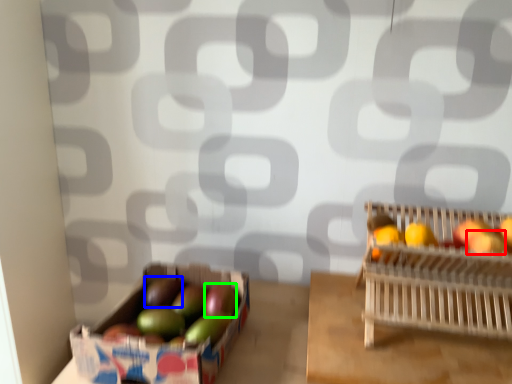
Question: Considering the real-world distances, which object is farthest from apple (highlighted by a red box)? apple (highlighted by a blue box) or apple (highlighted by a green box)?

Choices:
 (A) apple
 (B) apple

Answer: (A)